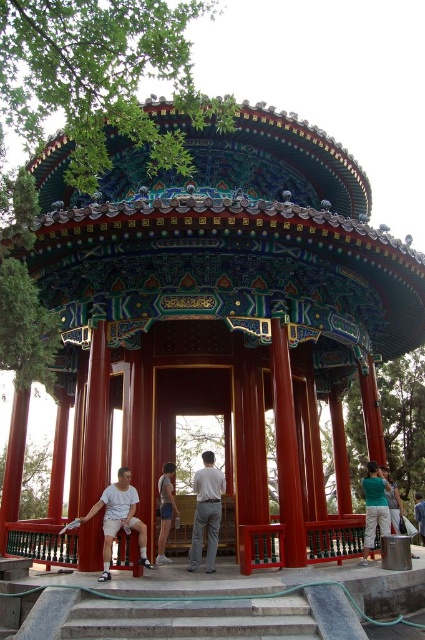
You are standing at the entrance of the traditional Chinese pavilion and want to reach the area behind the pavilion. Which direction should you go from the concrete stairs at center to reach the area behind the pavilion?

To reach the area behind the pavilion, you should go away from the entrance, which would be the direction opposite to where you are currently facing. Since the concrete stairs at center are located at point (190, 620), moving in the direction away from the entrance would lead you to the area behind the pavilion.

You are a fashion designer observing a model wearing a white cotton shirt at lower center and denim shorts at center. Which clothing item takes up more space on the model?

The white cotton shirt at lower center is bigger than the denim shorts at center, so it takes up more space on the model.

You are standing in front of the traditional Chinese pavilion and notice the concrete stairs at center and the white cotton shirt at lower center. Which object is smaller in size?

The concrete stairs at center is smaller in size compared to the white cotton shirt at lower center according to the description.